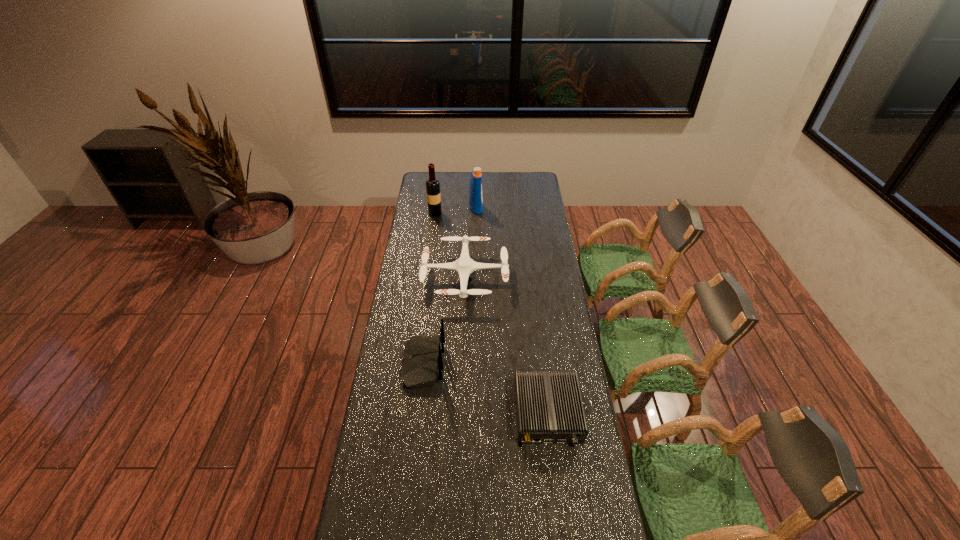
The image size is (960, 540). In order to click on the fourth closest object relative to the detergent in this screenshot , I will do `click(549, 409)`.

Identify the location of vacant region that satisfies the following two spatial constraints: 1. on the label of the detergent; 2. on the front side of the wine bottle. (476, 213).